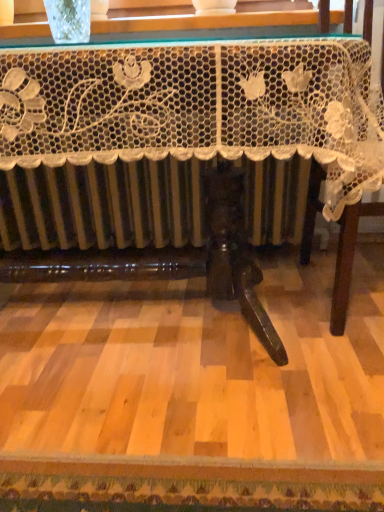
Based on the photo, what is the approximate width of white lace tablecloth at center?

The width of white lace tablecloth at center is 33.18 inches.

You are a GUI agent. You are given a task and a screenshot of the screen. Output one action in this format:
    pyautogui.click(x=<x>, y=<y>)
    Task: Click on the white lace tablecloth at center
    This screenshot has height=512, width=384.
    Given the screenshot: What is the action you would take?
    pyautogui.click(x=176, y=136)

What is the approximate height of white lace tablecloth at center?

73.84 centimeters.

Describe the element at coordinates (176, 136) in the screenshot. The height and width of the screenshot is (512, 384). I see `white lace tablecloth at center` at that location.

What do you see at coordinates (347, 260) in the screenshot? Image resolution: width=384 pixels, height=512 pixels. I see `white lace tablecloth at right` at bounding box center [347, 260].

Image resolution: width=384 pixels, height=512 pixels. Find the location of `white lace tablecloth at right`. white lace tablecloth at right is located at coordinates (347, 260).

Where is `white lace tablecloth at center`? The width and height of the screenshot is (384, 512). white lace tablecloth at center is located at coordinates (176, 136).

Which is more to the right, white lace tablecloth at right or white lace tablecloth at center?

white lace tablecloth at right.

Is white lace tablecloth at right positioned before white lace tablecloth at center?

That is False.

Based on the photo, which point is more forward, [334,322] or [240,175]?

The point [240,175] is closer.

From the image's perspective, is white lace tablecloth at right above white lace tablecloth at center?

Yes, from the image's perspective, white lace tablecloth at right is over white lace tablecloth at center.

From a real-world perspective, does white lace tablecloth at right sit lower than white lace tablecloth at center?

No, from a real-world perspective, white lace tablecloth at right is not beneath white lace tablecloth at center.

Between white lace tablecloth at right and white lace tablecloth at center, which one has larger width?

white lace tablecloth at center.

Based on the photo, between white lace tablecloth at right and white lace tablecloth at center, which one has more height?

white lace tablecloth at right.

Is white lace tablecloth at right bigger or smaller than white lace tablecloth at center?

Clearly, white lace tablecloth at right is smaller in size than white lace tablecloth at center.

Would you say white lace tablecloth at center is part of white lace tablecloth at right's contents?

Definitely not — white lace tablecloth at center is not inside white lace tablecloth at right.

Is white lace tablecloth at right directly adjacent to white lace tablecloth at center?

No, white lace tablecloth at right is not in contact with white lace tablecloth at center.

Could you tell me if white lace tablecloth at right is facing white lace tablecloth at center?

No, white lace tablecloth at right is not oriented towards white lace tablecloth at center.

How many degrees apart are the facing directions of white lace tablecloth at right and white lace tablecloth at center?

The angle between the facing direction of white lace tablecloth at right and the facing direction of white lace tablecloth at center is 3.4 degrees.

Find the location of a particular element. This screenshot has width=384, height=512. table that is under the white lace tablecloth at right (from a real-world perspective) is located at coordinates (176, 136).

Visually, is white lace tablecloth at center positioned to the left or to the right of white lace tablecloth at right?

Clearly, white lace tablecloth at center is on the left of white lace tablecloth at right in the image.

Is white lace tablecloth at center positioned in front of white lace tablecloth at right?

Yes, the depth of white lace tablecloth at center is less than that of white lace tablecloth at right.

Is point (330, 88) in front of point (343, 308)?

Yes.

From the image's perspective, would you say white lace tablecloth at center is positioned over white lace tablecloth at right?

Result: Incorrect, from the image's perspective, white lace tablecloth at center is lower than white lace tablecloth at right.

From a real-world perspective, which is physically below, white lace tablecloth at center or white lace tablecloth at right?

white lace tablecloth at center is physically lower.

Can you confirm if white lace tablecloth at center is wider than white lace tablecloth at right?

Correct, the width of white lace tablecloth at center exceeds that of white lace tablecloth at right.

From their relative heights in the image, would you say white lace tablecloth at center is taller or shorter than white lace tablecloth at right?

Considering their sizes, white lace tablecloth at center has less height than white lace tablecloth at right.

From the picture: Looking at the image, does white lace tablecloth at center seem bigger or smaller compared to white lace tablecloth at right?

Considering their sizes, white lace tablecloth at center takes up more space than white lace tablecloth at right.

Is white lace tablecloth at right located within white lace tablecloth at center?

No.

Is white lace tablecloth at center not near white lace tablecloth at right?

They are positioned close to each other.

Looking at this image, is white lace tablecloth at center facing towards white lace tablecloth at right?

No.

How different are the orientations of white lace tablecloth at center and white lace tablecloth at right in degrees?

The angle between the facing direction of white lace tablecloth at center and the facing direction of white lace tablecloth at right is 3.4 degrees.

The height and width of the screenshot is (512, 384). In order to click on furniture behind the white lace tablecloth at center in this screenshot , I will do `click(347, 260)`.

Where is `table below the white lace tablecloth at right (from a real-world perspective)`? This screenshot has height=512, width=384. table below the white lace tablecloth at right (from a real-world perspective) is located at coordinates (176, 136).

Where is `furniture above the white lace tablecloth at center (from the image's perspective)`? The height and width of the screenshot is (512, 384). furniture above the white lace tablecloth at center (from the image's perspective) is located at coordinates (347, 260).